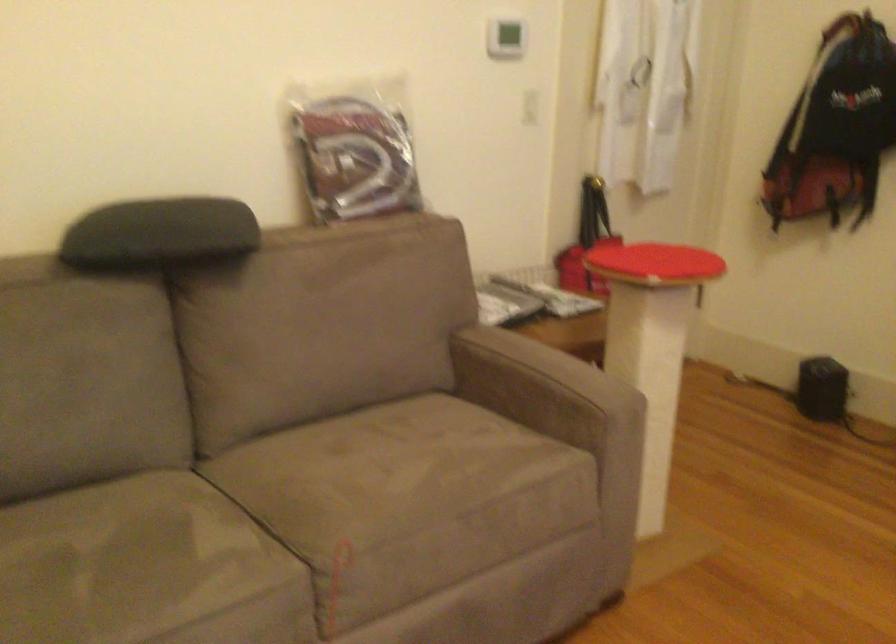
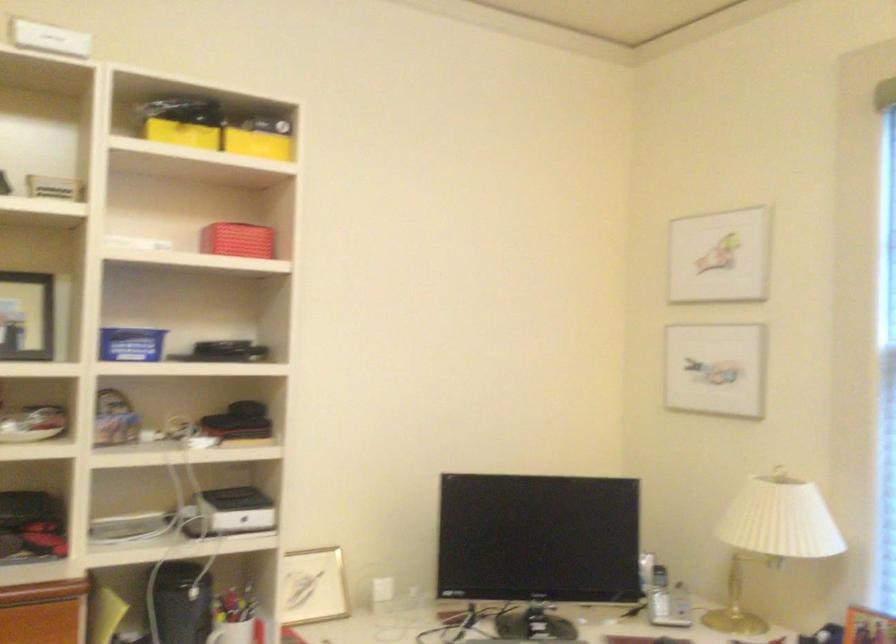
Question: Based on the continuous images, in which direction is the camera rotating? Reply with the corresponding letter.

Choices:
 (A) Left
 (B) Right
 (C) Up
 (D) Down

Answer: (B)